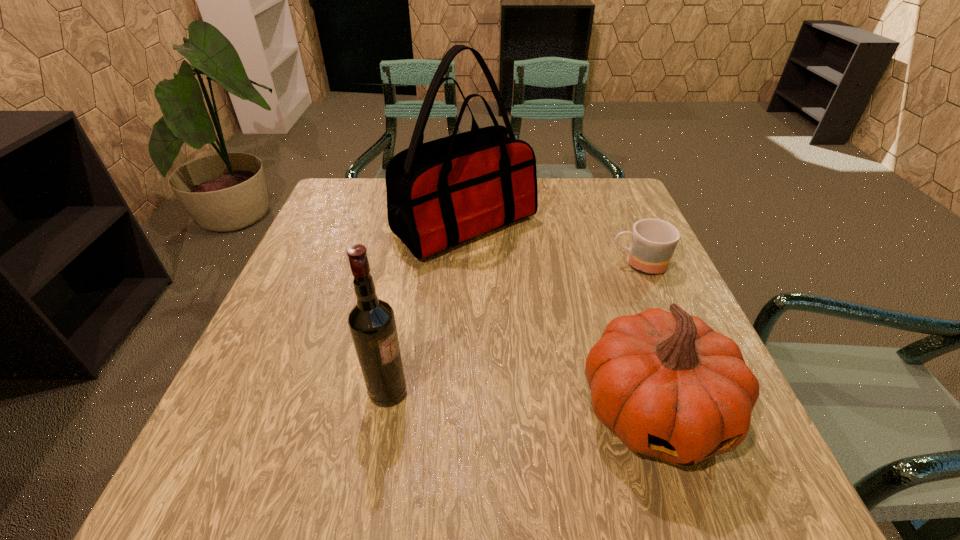
Locate an element on the screen. This screenshot has width=960, height=540. object that is at the near edge is located at coordinates (669, 386).

I want to click on pumpkin that is at the right edge, so click(669, 386).

Where is `mug that is positioned at the right edge`? This screenshot has width=960, height=540. mug that is positioned at the right edge is located at coordinates (653, 242).

Identify the location of object that is at the near right corner. (669, 386).

The height and width of the screenshot is (540, 960). I want to click on vacant space at the near edge, so click(463, 490).

You are a GUI agent. You are given a task and a screenshot of the screen. Output one action in this format:
    pyautogui.click(x=<x>, y=<y>)
    Task: Click on the vacant area at the right edge of the desktop
    This screenshot has width=960, height=540.
    Given the screenshot: What is the action you would take?
    pyautogui.click(x=592, y=239)

At what (x,y) coordinates should I click in order to perform the action: click on free location at the far left corner of the desktop. Please return your answer as a coordinate pair (x, y). This screenshot has height=540, width=960. Looking at the image, I should click on (362, 182).

This screenshot has height=540, width=960. In the image, there is a desktop. In order to click on vacant space at the near left corner in this screenshot , I will do tap(245, 510).

Locate an element on the screen. Image resolution: width=960 pixels, height=540 pixels. vacant space at the far right corner of the desktop is located at coordinates (626, 201).

Where is `free space at the near right corner of the desktop`? The height and width of the screenshot is (540, 960). free space at the near right corner of the desktop is located at coordinates (741, 453).